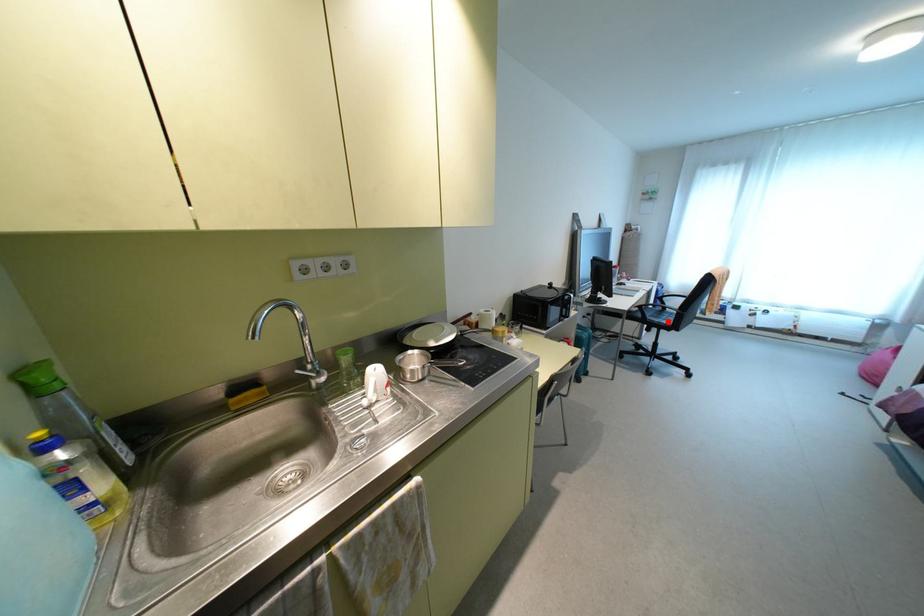
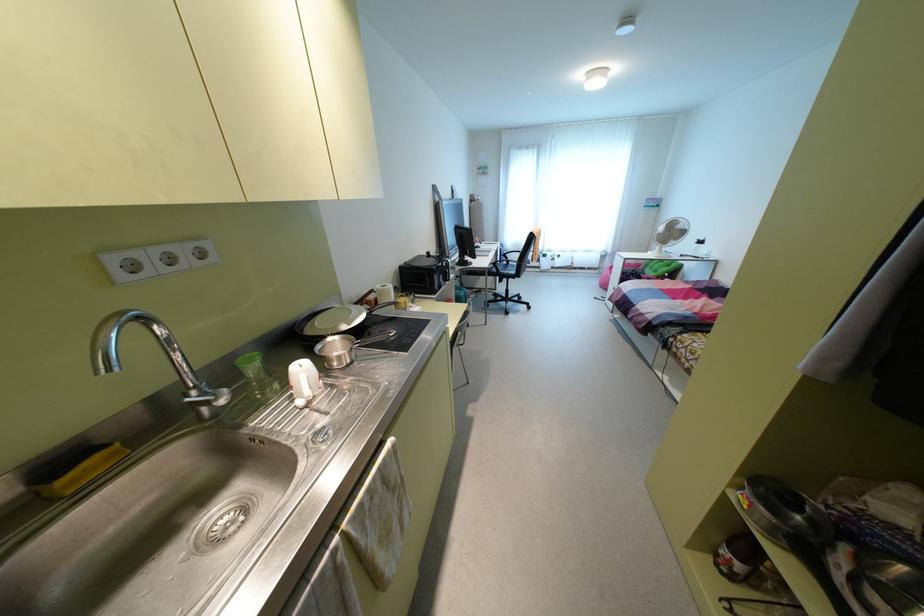
Question: I am providing you with two images of the same scene from different viewpoints. Given a red point in image1, look at the same physical point in image2. Is it:

Choices:
 (A) Closer to the viewpoint
 (B) Farther from the viewpoint

Answer: (B)